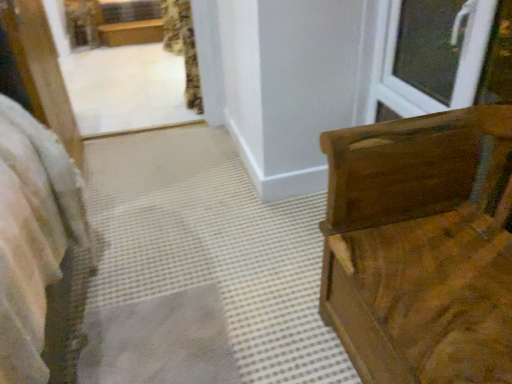
Find the location of a particular element. The image size is (512, 384). vacant point to the left of floral fabric curtain at upper center is located at coordinates (151, 103).